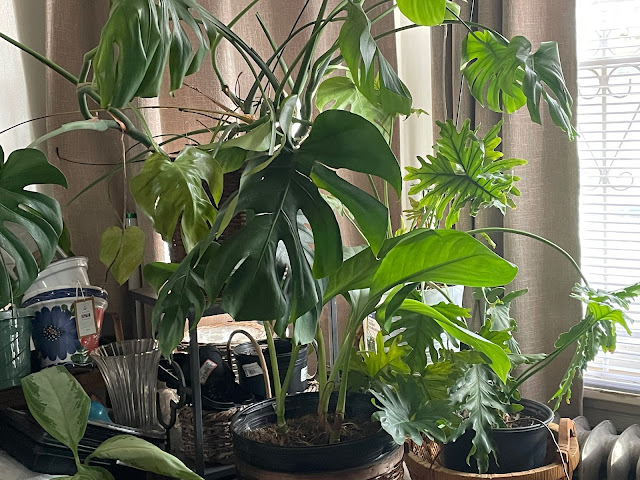
Identify the location of window sill. The image size is (640, 480). (609, 396).